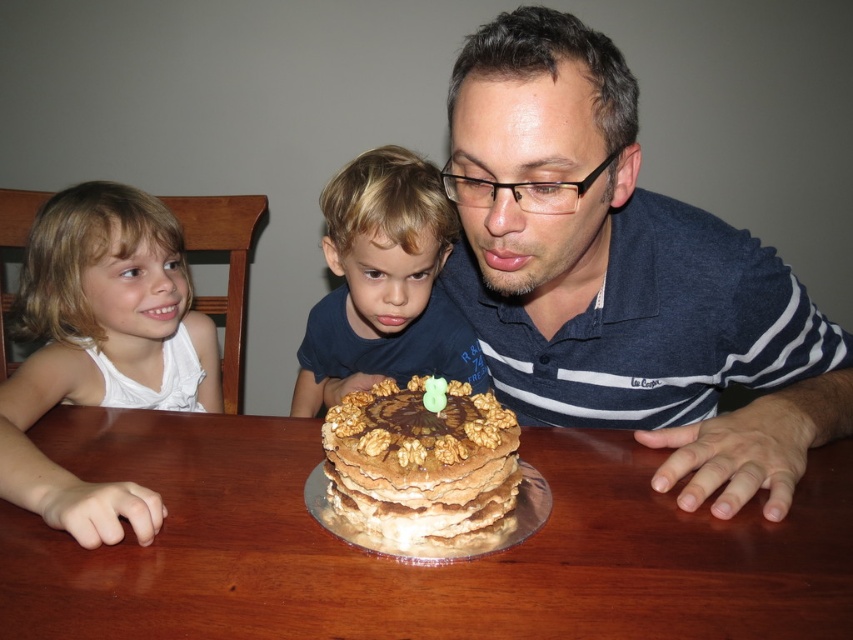
Question: Is the position of brown wooden table at center less distant than that of white fabric shirt at left?

Choices:
 (A) yes
 (B) no

Answer: (A)

Question: Which of these objects is positioned closest to the matte blue shirt at center?

Choices:
 (A) chocolate layered cake at center
 (B) white fabric shirt at left
 (C) blonde hair boy at center
 (D) brown wooden table at center

Answer: (C)

Question: In this image, where is brown wooden table at center located relative to matte blue shirt at center?

Choices:
 (A) above
 (B) below

Answer: (B)

Question: Which object appears farthest from the camera in this image?

Choices:
 (A) white fabric shirt at left
 (B) blonde hair boy at center

Answer: (B)

Question: Does brown wooden table at center have a greater width compared to blonde hair boy at center?

Choices:
 (A) no
 (B) yes

Answer: (B)

Question: Which point is closer to the camera?

Choices:
 (A) white fabric shirt at left
 (B) blonde hair boy at center

Answer: (A)